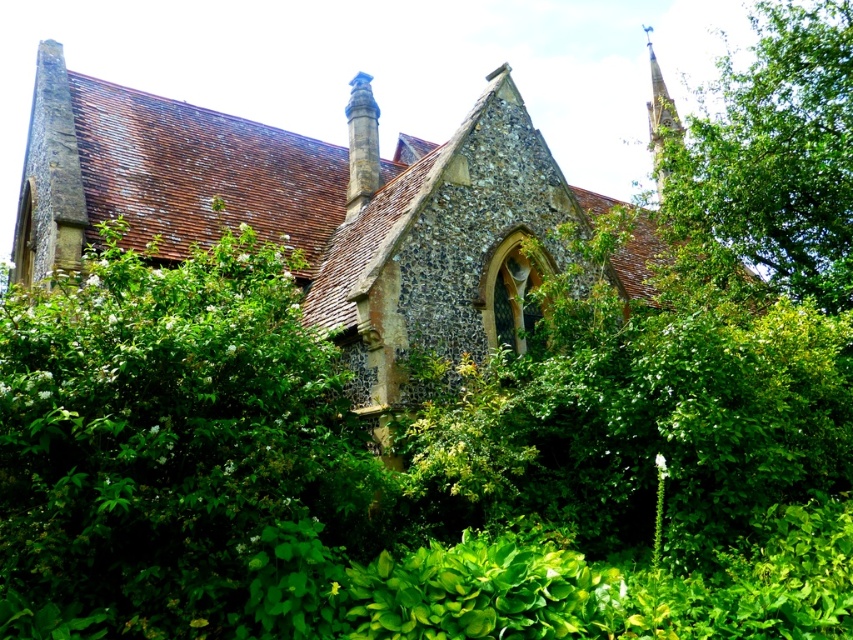
You are an architect analyzing the building. You notice the green leafy tree at upper right and the smooth stone spire at upper right. Which of these two objects takes up more area in the image?

The smooth stone spire at upper right occupies more space than the green leafy tree at upper right.